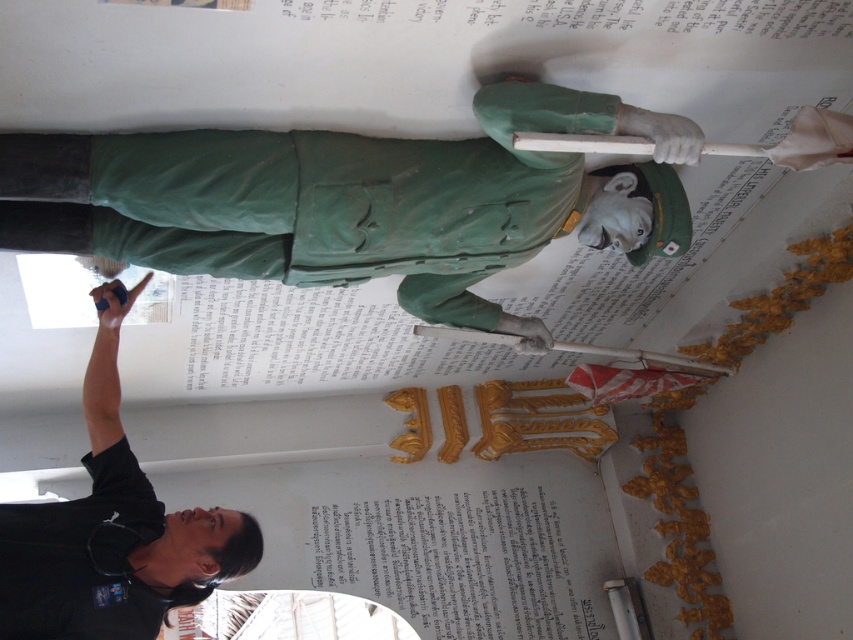
You are standing in the museum and want to take a photo of the matte green statue at upper center. If you are using a camera with a crosshair targeting system, what are the coordinates you should aim for?

The coordinates for the matte green statue at upper center are at point (346, 200), so you should aim your camera at those coordinates to capture it.

Consider the image. You are standing in the museum and see two points marked on the wall. The first point is at coordinates point (73,140) and the second point is at point (68,624). Which point is closer to you?

Point (73,140) is closer to the camera than point (68,624), so the first point is closer to you.

You are standing in the museum and want to take a photo of the statue of a soldier dressed in a green uniform holding a rifle. There is a point at coordinates (519, 128) that is 1.80 meters away from you. If your camera has a focal length of 50mm and you want to ensure the point is in focus, what is the minimum distance you should be from the statue?

The point at coordinates (519, 128) is 1.80 meters away from you. To ensure this point is in focus, you should be at least 1.80 meters away from the statue.